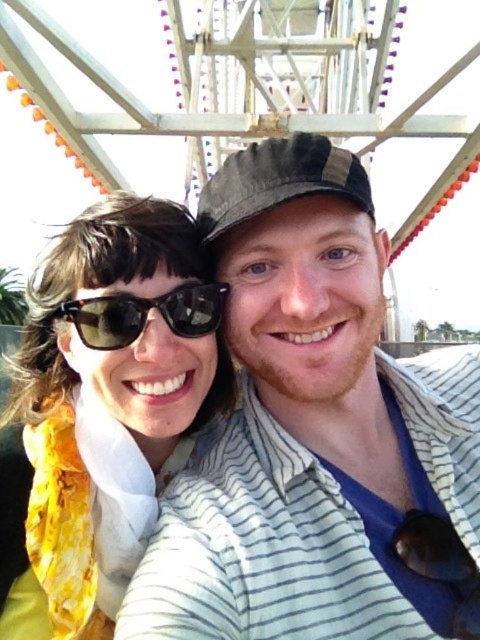
Does point (148, 403) come closer to viewer compared to point (199, 307)?

Yes, it is in front of point (199, 307).

Which of these two, yellow fabric scarf at left or black reflective sunglasses at center, stands shorter?

With less height is black reflective sunglasses at center.

Where is `yellow fabric scarf at left`? yellow fabric scarf at left is located at coordinates (111, 396).